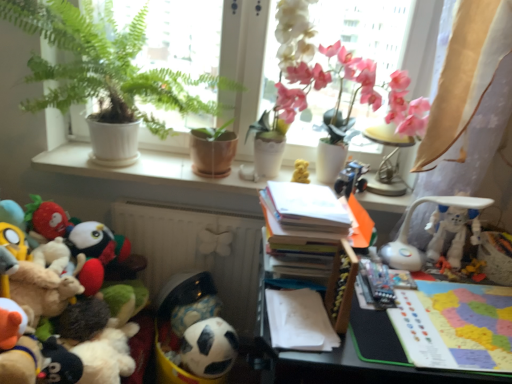
Where is `vacant area that lies in front of white plastic robot at right, the fifth toy when ordered from left to right`? The image size is (512, 384). vacant area that lies in front of white plastic robot at right, the fifth toy when ordered from left to right is located at coordinates (441, 325).